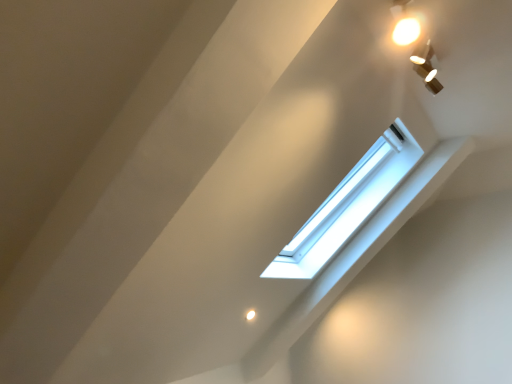
The image size is (512, 384). Describe the element at coordinates (426, 65) in the screenshot. I see `matte gold spotlight at upper right` at that location.

I want to click on matte gold spotlight at upper right, so click(x=426, y=65).

Find the location of `matte gold spotlight at upper right`. matte gold spotlight at upper right is located at coordinates [426, 65].